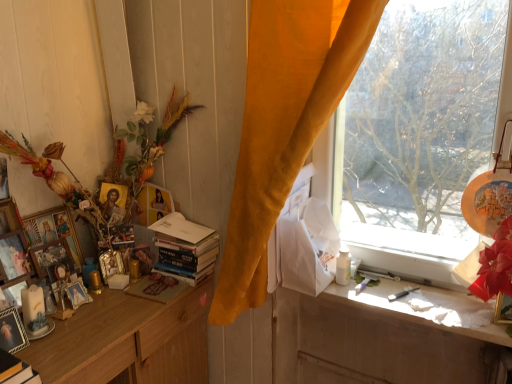
At what (x,y) coordinates should I click in order to perform the action: click on vacant area on top of hardcover books at center (from a real-world perspective). Please return your answer as a coordinate pair (x, y). Image resolution: width=512 pixels, height=384 pixels. Looking at the image, I should click on (170, 219).